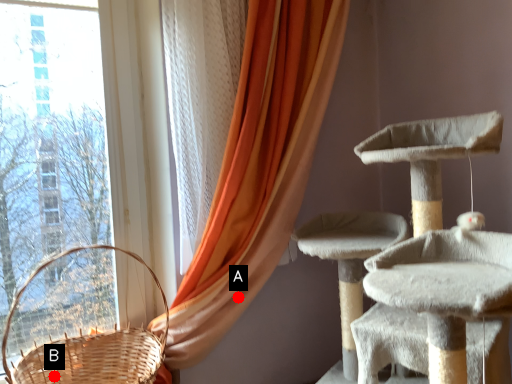
Question: Two points are circled on the image, labeled by A and B beside each circle. Which of the following is the farthest from the observer?

Choices:
 (A) A is further
 (B) B is further

Answer: (A)